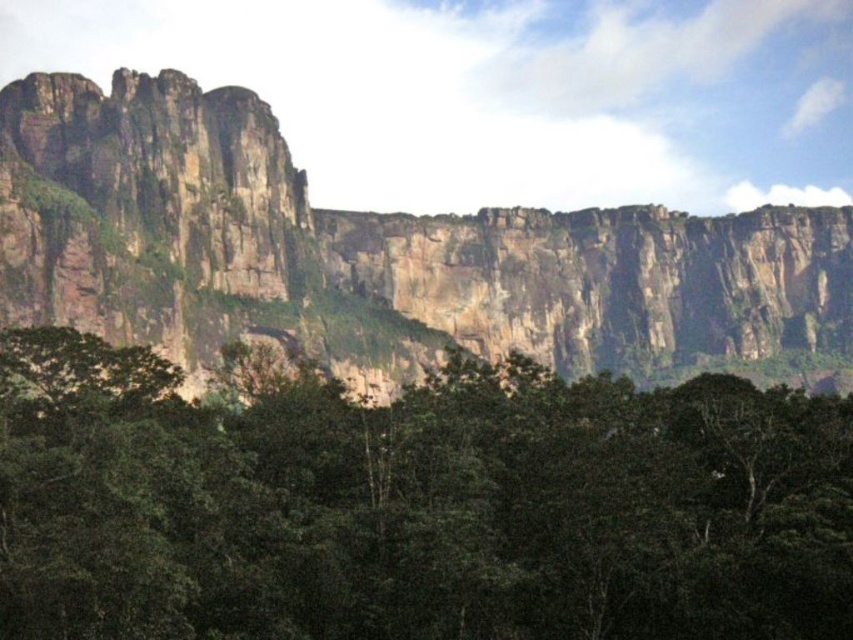
Based on the photo, measure the distance between green leafy trees at center and rugged rock cliff at upper center.

30.92 meters

Find the location of a particular element. This screenshot has height=640, width=853. green leafy trees at center is located at coordinates (415, 506).